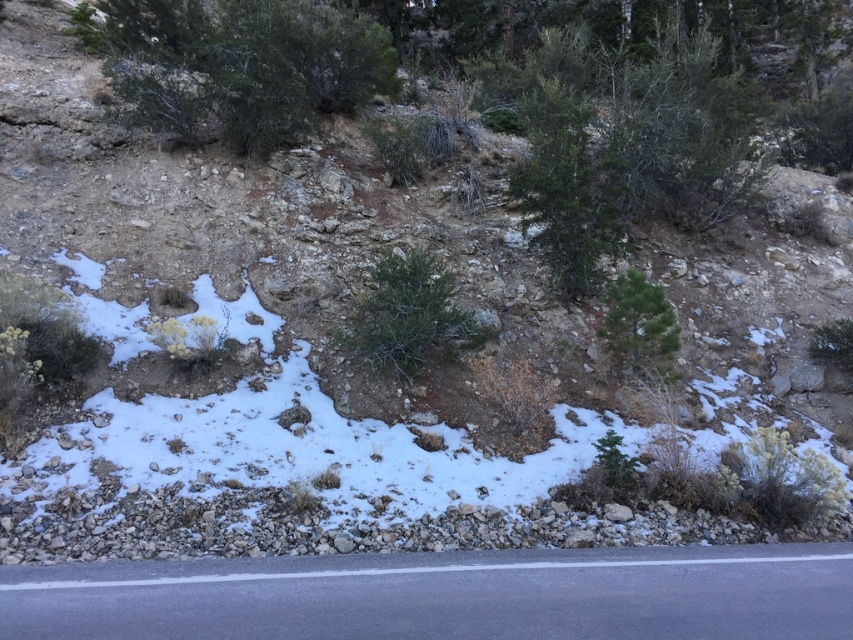
Question: Does green leafy bush at upper left appear on the right side of green leafy tree at upper center?

Choices:
 (A) no
 (B) yes

Answer: (A)

Question: Which of these objects is positioned closest to the green needle-like at center?

Choices:
 (A) green leafy tree at upper center
 (B) green leafy bush at upper left

Answer: (A)

Question: Is green leafy bush at upper left to the right of green leafy tree at upper center from the viewer's perspective?

Choices:
 (A) no
 (B) yes

Answer: (A)

Question: Estimate the real-world distances between objects in this image. Which object is farther from the asphalt at lower center?

Choices:
 (A) green leafy bush at upper left
 (B) green needle-like at center

Answer: (A)

Question: Which of the following is the closest to the observer?

Choices:
 (A) (608, 317)
 (B) (109, 576)
 (C) (549, 168)
 (D) (171, 106)

Answer: (B)

Question: Is green leafy bush at upper left smaller than green leafy tree at upper center?

Choices:
 (A) yes
 (B) no

Answer: (A)